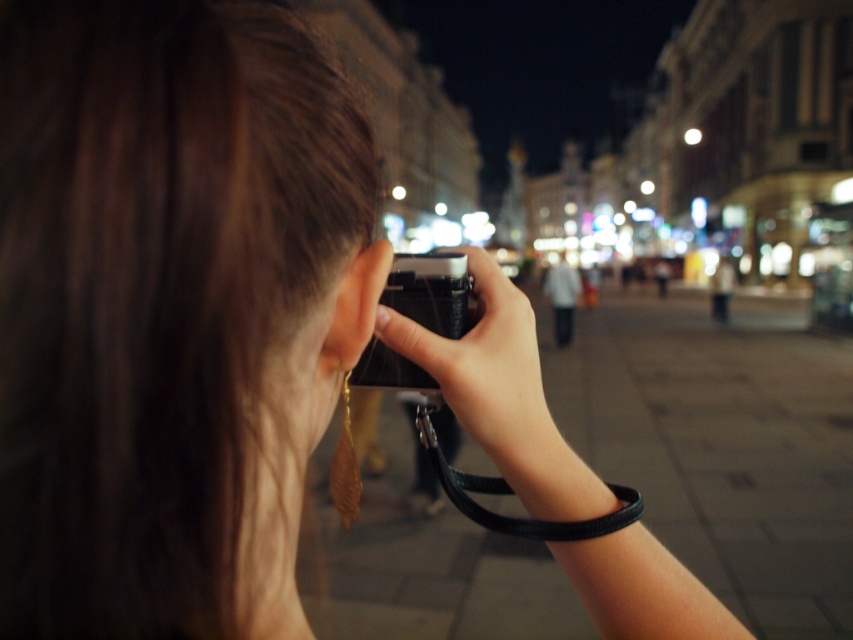
You are standing in the nighttime urban scene and want to take a photo of two points in the image. The first point is at coordinates point (415, 356) and the second is at point (437, 300). Which point is closer to your current position?

Point (415, 356) is closer to the camera than point (437, 300), so the first point is closer to your current position.

You are a photographer trying to position your camera exactly at the center of the frame. According to the scene description, where should you place the black matte camera at center?

The black matte camera at center should be placed at point (x=486, y=371) to be at the specified position.